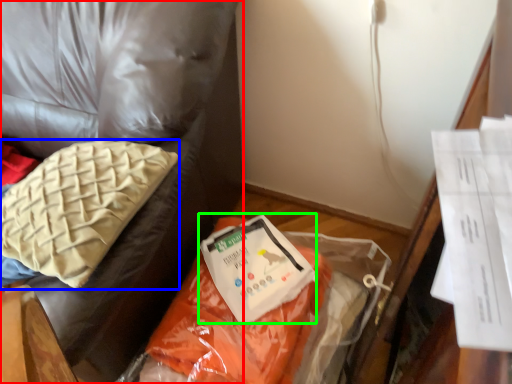
Question: Which object is positioned closest to furniture (highlighted by a red box)? Select from pillow (highlighted by a blue box) and wrap (highlighted by a green box).

Choices:
 (A) pillow
 (B) wrap

Answer: (A)